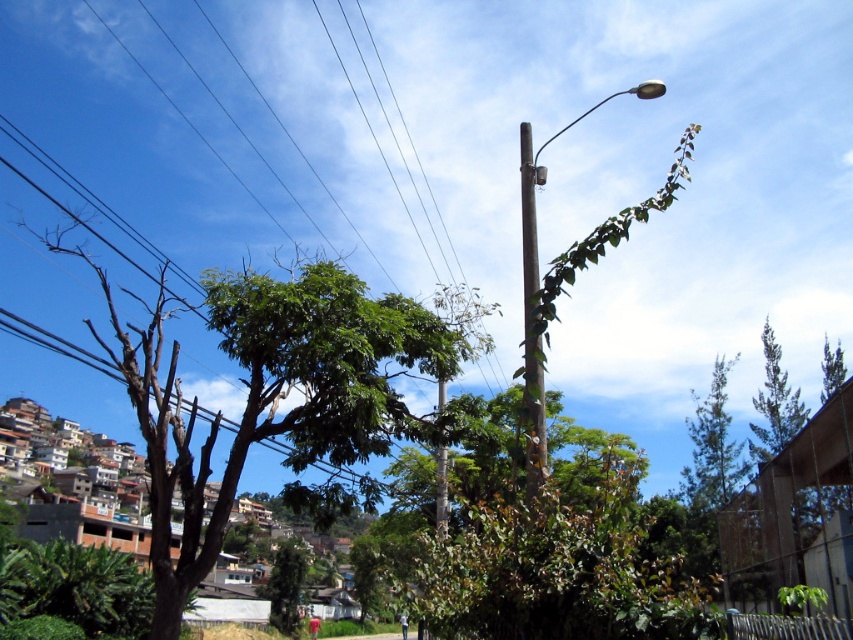
Question: In this image, where is green leafy tree at left located relative to green leafy tree at lower center?

Choices:
 (A) left
 (B) right

Answer: (B)

Question: Which object is the farthest from the metallic pole at upper right?

Choices:
 (A) green leafy tree at left
 (B) brown wooden telegraph pole at center

Answer: (B)

Question: Which point is closer to the camera taking this photo?

Choices:
 (A) (155, 586)
 (B) (292, 564)
 (C) (663, 84)

Answer: (A)

Question: Is brown wooden telegraph pole at center further to camera compared to green leafy tree at lower center?

Choices:
 (A) yes
 (B) no

Answer: (B)

Question: Which is nearer to the green leafy tree at left?

Choices:
 (A) metallic pole at upper right
 (B) green leafy tree at lower center
 (C) brown wooden telegraph pole at center

Answer: (C)

Question: Is metallic pole at upper right wider than brown wooden telegraph pole at center?

Choices:
 (A) yes
 (B) no

Answer: (A)